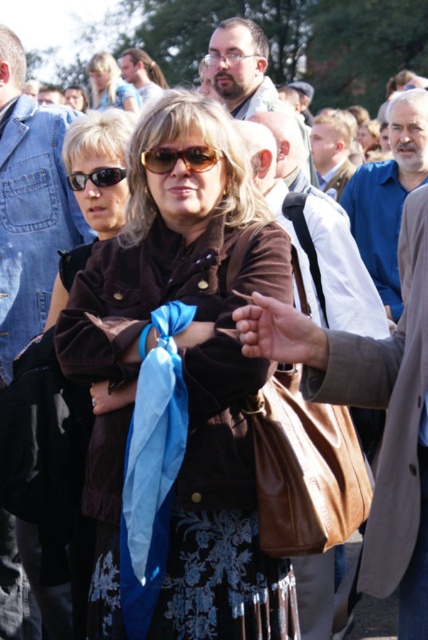
Question: Where is blue fabric ribbon at center located in relation to matte black glasses at center in the image?

Choices:
 (A) left
 (B) right

Answer: (A)

Question: Which point is closer to the camera?

Choices:
 (A) matte black glasses at center
 (B) brushed denim jacket at left

Answer: (B)

Question: Which point is farther to the camera?

Choices:
 (A) (275, 102)
 (B) (95, 176)
 (C) (174, 372)

Answer: (A)

Question: Estimate the real-world distances between objects in this image. Which object is closer to the brown leather jacket at center?

Choices:
 (A) brown suede jacket at center
 (B) brown textured sunglasses at center

Answer: (B)

Question: Can you confirm if brown leather jacket at center is smaller than matte black glasses at center?

Choices:
 (A) yes
 (B) no

Answer: (B)

Question: Does brown suede jacket at center appear over matte black glasses at center?

Choices:
 (A) no
 (B) yes

Answer: (A)